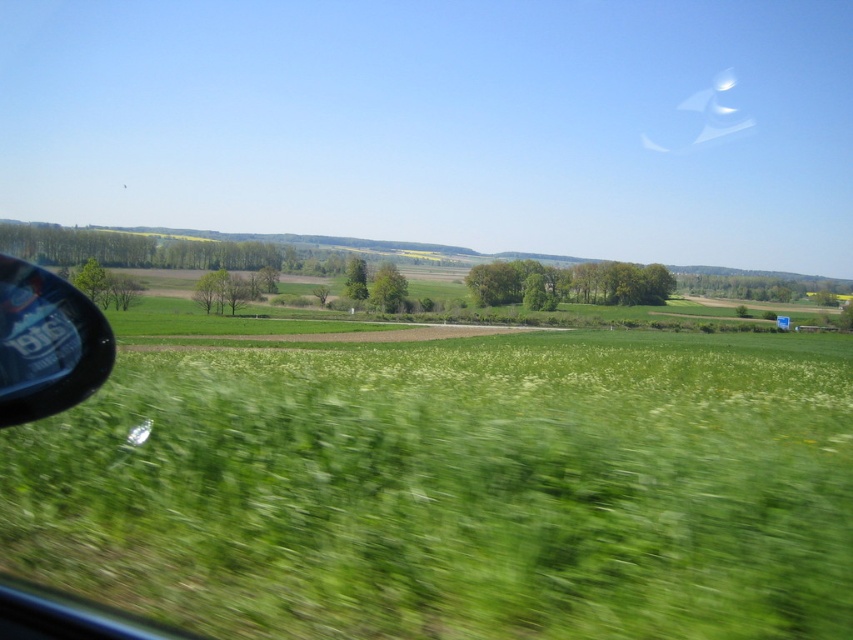
You are a passenger in a car and looking out the window. You notice the green grass at lower left and the transparent plastic side mirror at lower left. Which object appears thinner from your viewpoint?

The green grass at lower left appears thinner than the transparent plastic side mirror at lower left according to the description.

From the picture: You are sitting in the driver seat of the car and looking out the side window. Where is the green grass at lower left located in terms of 2D coordinates?

The green grass at lower left is located at point [454,490] in 2D coordinates.